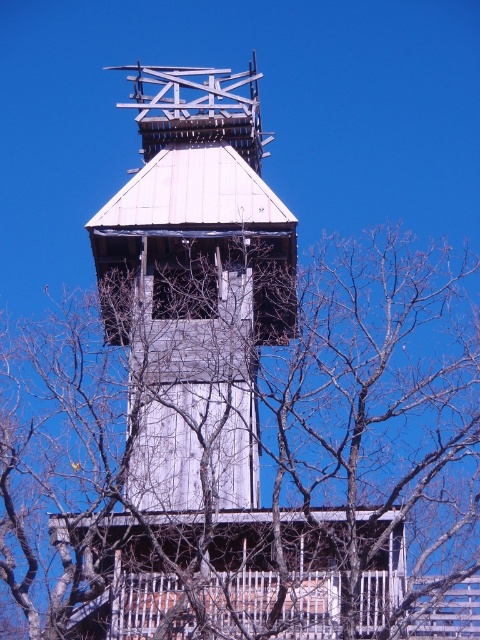
This screenshot has width=480, height=640. I want to click on bare branches at center, so click(248, 451).

Can you confirm if bare branches at center is bigger than white wooden tower at center?

Indeed, bare branches at center has a larger size compared to white wooden tower at center.

This screenshot has height=640, width=480. I want to click on bare branches at center, so click(248, 451).